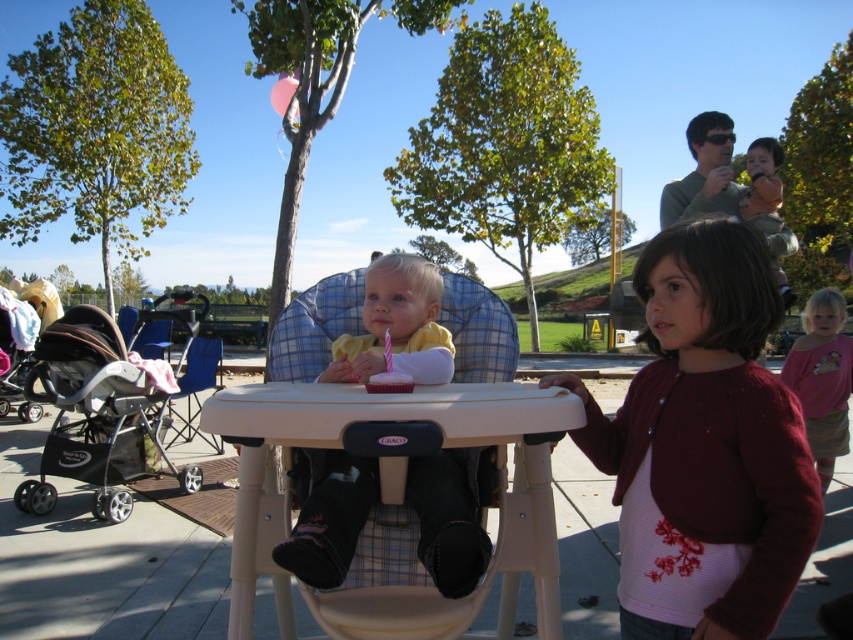
Does matte yellow shirt at center have a lesser height compared to orange cotton shirt at upper right?

Indeed, matte yellow shirt at center has a lesser height compared to orange cotton shirt at upper right.

At what (x,y) coordinates should I click in order to perform the action: click on matte yellow shirt at center. Please return your answer as a coordinate pair (x, y). The image size is (853, 640). Looking at the image, I should click on (450, 520).

You are a GUI agent. You are given a task and a screenshot of the screen. Output one action in this format:
    pyautogui.click(x=<x>, y=<y>)
    Task: Click on the matte yellow shirt at center
    This screenshot has height=640, width=853.
    Given the screenshot: What is the action you would take?
    pyautogui.click(x=450, y=520)

What do you see at coordinates (704, 445) in the screenshot?
I see `pink sweater at center` at bounding box center [704, 445].

Does pink sweater at center appear on the left side of pink cotton shirt at lower right?

Correct, you'll find pink sweater at center to the left of pink cotton shirt at lower right.

The image size is (853, 640). Describe the element at coordinates (704, 445) in the screenshot. I see `pink sweater at center` at that location.

Where is `pink sweater at center`? The image size is (853, 640). pink sweater at center is located at coordinates (704, 445).

Is matte yellow shirt at center further to camera compared to green fabric shirt at upper right?

No, it is in front of green fabric shirt at upper right.

From the picture: Which is above, matte yellow shirt at center or green fabric shirt at upper right?

green fabric shirt at upper right is above.

Describe the element at coordinates (450, 520) in the screenshot. This screenshot has width=853, height=640. I see `matte yellow shirt at center` at that location.

Where is `matte yellow shirt at center`? Image resolution: width=853 pixels, height=640 pixels. matte yellow shirt at center is located at coordinates (450, 520).